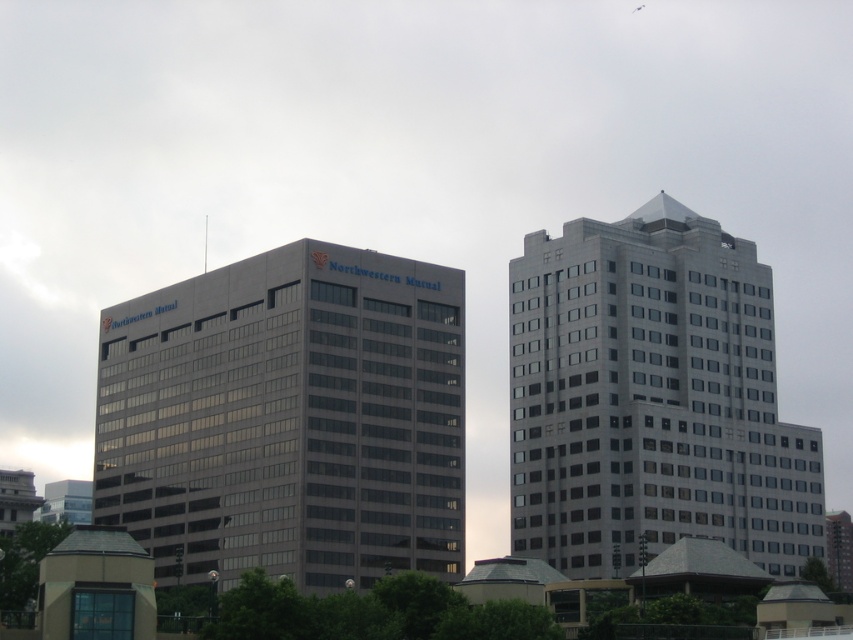
You are standing at the point marked as point (288, 419) in the image. Which building are you facing? The image shows two office buildings, one with a blue Northwestern Mutual sign and another gray glass building at center. Please choose between the two buildings based on your position.

The point (288, 419) is located on the gray glass building at center, so you are facing the gray glass building at center.